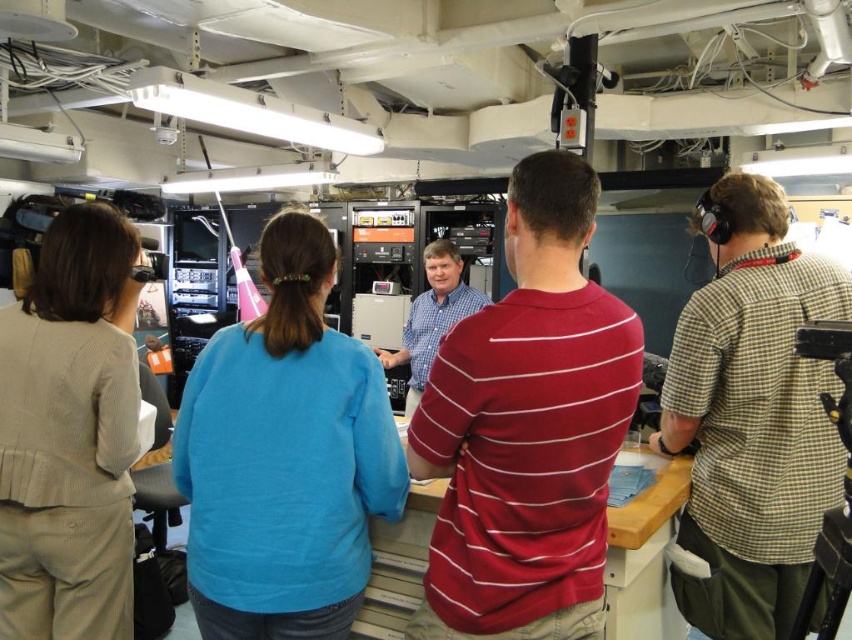
From the picture: Which is more to the right, checkered fabric shirt at right or black plastic tripod at right?

From the viewer's perspective, black plastic tripod at right appears more on the right side.

Can you confirm if checkered fabric shirt at right is smaller than black plastic tripod at right?

No, checkered fabric shirt at right is not smaller than black plastic tripod at right.

Locate an element on the screen. checkered fabric shirt at right is located at coordinates (751, 416).

Is checkered fabric shirt at right below blue plaid shirt at center?

Indeed, checkered fabric shirt at right is positioned under blue plaid shirt at center.

Measure the distance between checkered fabric shirt at right and camera.

The distance of checkered fabric shirt at right from camera is 1.74 meters.

Between point (758, 304) and point (430, 310), which one is positioned in front?

Point (758, 304) is more forward.

I want to click on checkered fabric shirt at right, so click(751, 416).

Looking at this image, is red striped shirt at center smaller than black plastic tripod at right?

Incorrect, red striped shirt at center is not smaller in size than black plastic tripod at right.

Does point (540, 390) lie behind point (839, 509)?

No, (540, 390) is in front of (839, 509).

The height and width of the screenshot is (640, 852). In order to click on red striped shirt at center in this screenshot , I will do `click(527, 428)`.

What are the coordinates of `red striped shirt at center` in the screenshot? It's located at (527, 428).